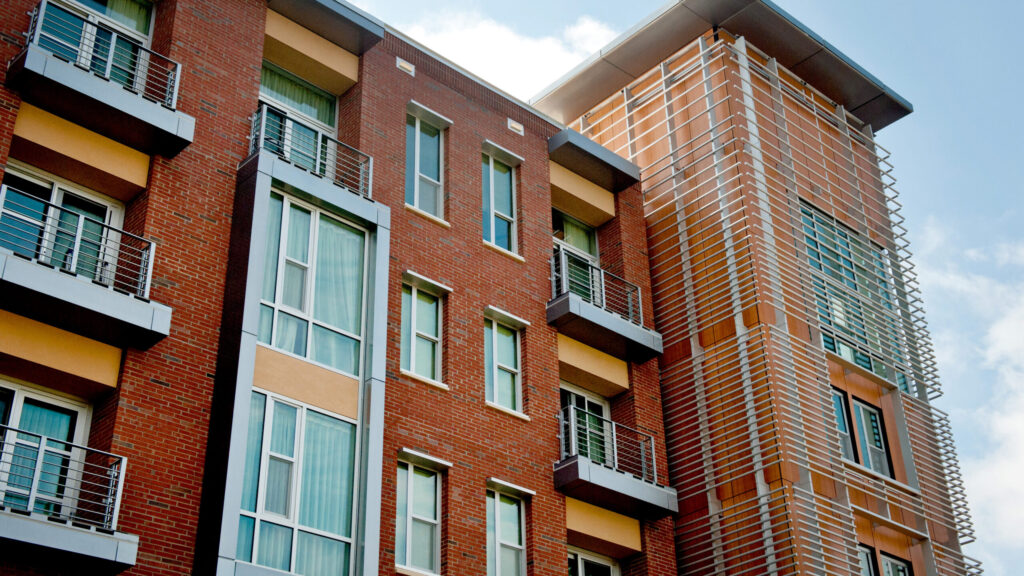
Where is `blinds`? blinds is located at coordinates (343, 272), (325, 492).